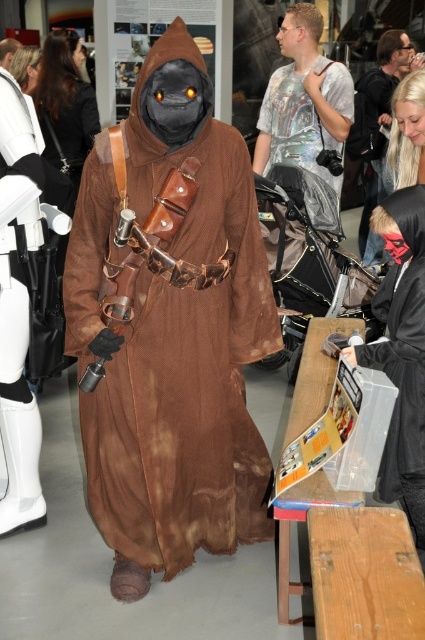
Can you confirm if brown fabric costume at center is positioned to the right of black matte mask at right?

Incorrect, brown fabric costume at center is not on the right side of black matte mask at right.

Which is more to the right, brown fabric costume at center or black matte mask at right?

black matte mask at right

This screenshot has height=640, width=425. Identify the location of brown fabric costume at center. (170, 326).

Where is `brown fabric costume at center`? The image size is (425, 640). brown fabric costume at center is located at coordinates (170, 326).

Does black matte mask at right have a lesser width compared to smooth black mask at upper right?

Yes.

Is black matte mask at right wider than smooth black mask at upper right?

No.

Between point (371, 308) and point (396, 80), which one is positioned behind?

The point (396, 80) is behind.

The height and width of the screenshot is (640, 425). In order to click on black matte mask at right in this screenshot , I will do `click(402, 352)`.

Which is below, holographic t-shirt at center or smooth black mask at upper right?

holographic t-shirt at center is below.

Can you confirm if holographic t-shirt at center is positioned to the left of smooth black mask at upper right?

Yes, holographic t-shirt at center is to the left of smooth black mask at upper right.

Where is `holographic t-shirt at center`? This screenshot has width=425, height=640. holographic t-shirt at center is located at coordinates (303, 100).

You are a GUI agent. You are given a task and a screenshot of the screen. Output one action in this format:
    pyautogui.click(x=<x>, y=<y>)
    Task: Click on the holographic t-shirt at center
    Image resolution: width=425 pixels, height=640 pixels.
    Given the screenshot: What is the action you would take?
    pyautogui.click(x=303, y=100)